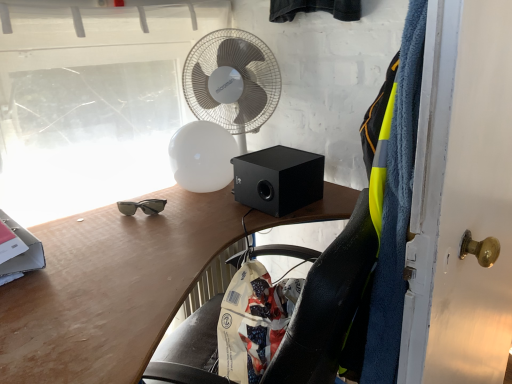
Question: Is black matte speaker at center taller than matte wood desk at center?

Choices:
 (A) no
 (B) yes

Answer: (A)

Question: Is black matte speaker at center closer to the viewer compared to matte wood desk at center?

Choices:
 (A) yes
 (B) no

Answer: (B)

Question: Considering the relative sizes of black matte speaker at center and matte wood desk at center in the image provided, is black matte speaker at center smaller than matte wood desk at center?

Choices:
 (A) yes
 (B) no

Answer: (A)

Question: Can you confirm if black matte speaker at center is wider than matte wood desk at center?

Choices:
 (A) yes
 (B) no

Answer: (B)

Question: Is there a large distance between black matte speaker at center and matte wood desk at center?

Choices:
 (A) no
 (B) yes

Answer: (A)

Question: Considering the positions of white painted wood door at right and white plastic mechanical fan at upper center in the image, is white painted wood door at right bigger or smaller than white plastic mechanical fan at upper center?

Choices:
 (A) small
 (B) big

Answer: (B)

Question: In the image, is white painted wood door at right positioned in front of or behind white plastic mechanical fan at upper center?

Choices:
 (A) front
 (B) behind

Answer: (A)

Question: Considering the relative positions of white painted wood door at right and white plastic mechanical fan at upper center in the image provided, is white painted wood door at right to the left or to the right of white plastic mechanical fan at upper center?

Choices:
 (A) right
 (B) left

Answer: (A)

Question: From their relative heights in the image, would you say white painted wood door at right is taller or shorter than white plastic mechanical fan at upper center?

Choices:
 (A) short
 (B) tall

Answer: (B)

Question: Based on their positions, is white painted wood door at right located to the left or right of matte wood desk at center?

Choices:
 (A) left
 (B) right

Answer: (B)

Question: Do you think white painted wood door at right is within matte wood desk at center, or outside of it?

Choices:
 (A) inside
 (B) outside

Answer: (B)

Question: From a real-world perspective, is white painted wood door at right above or below matte wood desk at center?

Choices:
 (A) above
 (B) below

Answer: (A)

Question: From the image's perspective, is white painted wood door at right above or below matte wood desk at center?

Choices:
 (A) below
 (B) above

Answer: (B)

Question: In terms of height, does black matte speaker at center look taller or shorter compared to matte wood desk at center?

Choices:
 (A) tall
 (B) short

Answer: (B)

Question: Is black matte speaker at center in front of or behind matte wood desk at center in the image?

Choices:
 (A) behind
 (B) front

Answer: (A)